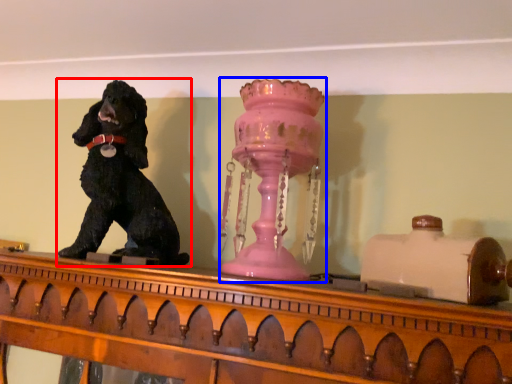
Question: Which object is closer to the camera taking this photo, dog (highlighted by a red box) or candle holder (highlighted by a blue box)?

Choices:
 (A) dog
 (B) candle holder

Answer: (B)